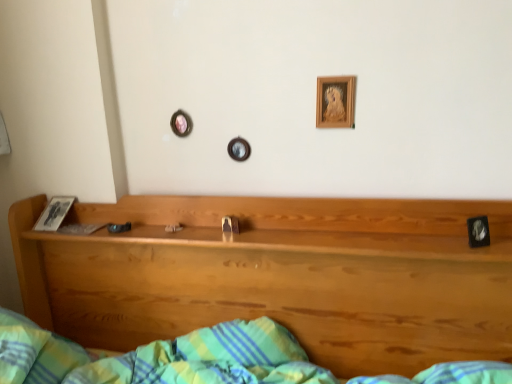
This screenshot has height=384, width=512. Describe the element at coordinates (478, 231) in the screenshot. I see `black glossy picture frame at right, acting as the 2th picture frame starting from the back` at that location.

What do you see at coordinates (335, 102) in the screenshot? The height and width of the screenshot is (384, 512). I see `wooden picture frame at upper center, the 1th picture frame when ordered from left to right` at bounding box center [335, 102].

You are a GUI agent. You are given a task and a screenshot of the screen. Output one action in this format:
    pyautogui.click(x=<x>, y=<y>)
    Task: Click on the black glossy picture frame at right, positioned as the first picture frame in front-to-back order
    The width and height of the screenshot is (512, 384).
    Given the screenshot: What is the action you would take?
    pyautogui.click(x=478, y=231)

Which of these two, wooden headboard at center or wooden picture frame at upper center, the 2th picture frame from the front, is thinner?

Thinner between the two is wooden picture frame at upper center, the 2th picture frame from the front.

From a real-world perspective, relative to wooden picture frame at upper center, which ranks as the 1th picture frame in top-to-bottom order, is wooden headboard at center vertically above or below?

Clearly, from a real-world perspective, wooden headboard at center is below wooden picture frame at upper center, which ranks as the 1th picture frame in top-to-bottom order.

Measure the distance between wooden headboard at center and wooden picture frame at upper center, the 1th picture frame positioned from the back.

wooden headboard at center and wooden picture frame at upper center, the 1th picture frame positioned from the back, are 23.59 inches apart.

Is wooden headboard at center with wooden picture frame at upper center, the 2th picture frame from the front?

No.

Can you tell me how much wooden picture frame at upper center, arranged as the second picture frame when viewed from the right, and black glossy picture frame at right, the first picture frame from the right, differ in facing direction?

wooden picture frame at upper center, arranged as the second picture frame when viewed from the right, and black glossy picture frame at right, the first picture frame from the right, are facing 28.7 degrees away from each other.

Considering the relative sizes of wooden picture frame at upper center, the 1th picture frame when ordered from left to right, and black glossy picture frame at right, marked as the first picture frame in a bottom-to-top arrangement, in the image provided, is wooden picture frame at upper center, the 1th picture frame when ordered from left to right, taller than black glossy picture frame at right, marked as the first picture frame in a bottom-to-top arrangement,?

Indeed, wooden picture frame at upper center, the 1th picture frame when ordered from left to right, has a greater height compared to black glossy picture frame at right, marked as the first picture frame in a bottom-to-top arrangement.

Is wooden picture frame at upper center, which appears as the second picture frame when ordered from the bottom, far away from black glossy picture frame at right, marked as the first picture frame in a bottom-to-top arrangement?

That's not correct — wooden picture frame at upper center, which appears as the second picture frame when ordered from the bottom, is a little close to black glossy picture frame at right, marked as the first picture frame in a bottom-to-top arrangement.

This screenshot has width=512, height=384. I want to click on picture frame above the black glossy picture frame at right, which is counted as the 2th picture frame, starting from the left (from a real-world perspective), so click(335, 102).

Considering the sizes of black glossy picture frame at right, which is counted as the 2th picture frame, starting from the left, and wooden picture frame at upper center, the 1th picture frame positioned from the back, in the image, is black glossy picture frame at right, which is counted as the 2th picture frame, starting from the left, bigger or smaller than wooden picture frame at upper center, the 1th picture frame positioned from the back,?

black glossy picture frame at right, which is counted as the 2th picture frame, starting from the left, is smaller than wooden picture frame at upper center, the 1th picture frame positioned from the back.

In terms of height, does black glossy picture frame at right, acting as the 2th picture frame starting from the back, look taller or shorter compared to wooden picture frame at upper center, arranged as the second picture frame when viewed from the right?

Clearly, black glossy picture frame at right, acting as the 2th picture frame starting from the back, is shorter compared to wooden picture frame at upper center, arranged as the second picture frame when viewed from the right.

Is black glossy picture frame at right, which is counted as the 2th picture frame, starting from the left, completely or partially outside of wooden picture frame at upper center, which ranks as the 1th picture frame in top-to-bottom order?

Absolutely, black glossy picture frame at right, which is counted as the 2th picture frame, starting from the left, is external to wooden picture frame at upper center, which ranks as the 1th picture frame in top-to-bottom order.

From the image's perspective, relative to wooden picture frame at upper center, the 2th picture frame from the front, is black glossy picture frame at right, the first picture frame from the right, above or below?

black glossy picture frame at right, the first picture frame from the right, is situated lower than wooden picture frame at upper center, the 2th picture frame from the front, in the image.

Is black glossy picture frame at right, the first picture frame from the right, taller or shorter than wooden headboard at center?

Considering their sizes, black glossy picture frame at right, the first picture frame from the right, has less height than wooden headboard at center.

Is point (468, 220) closer to camera compared to point (118, 282)?

That is True.

Is black glossy picture frame at right, which is counted as the 2th picture frame, starting from the left, in front of wooden headboard at center?

No, it is not.

Find the location of a particular element. bunk bed lying below the wooden picture frame at upper center, the 1th picture frame positioned from the back (from the image's perspective) is located at coordinates (279, 276).

Is wooden picture frame at upper center, the 2th picture frame from the front, with wooden headboard at center?

wooden picture frame at upper center, the 2th picture frame from the front, and wooden headboard at center are not in contact.

Based on the photo, is wooden picture frame at upper center, which appears as the second picture frame when ordered from the bottom, taller than wooden headboard at center?

In fact, wooden picture frame at upper center, which appears as the second picture frame when ordered from the bottom, may be shorter than wooden headboard at center.

Is the depth of wooden picture frame at upper center, which ranks as the 1th picture frame in top-to-bottom order, greater than that of wooden headboard at center?

Yes, it is behind wooden headboard at center.

How many degrees apart are the facing directions of wooden headboard at center and black glossy picture frame at right, positioned as the first picture frame in front-to-back order?

26.9 degrees separate the facing orientations of wooden headboard at center and black glossy picture frame at right, positioned as the first picture frame in front-to-back order.

Is point (110, 319) farther from camera compared to point (488, 235)?

Yes, it is behind point (488, 235).

Is wooden headboard at center closer to camera compared to black glossy picture frame at right, the first picture frame from the right?

Yes.

At what (x,y) coordinates should I click in order to perform the action: click on picture frame that is the 2nd object above the wooden headboard at center (from a real-world perspective). Please return your answer as a coordinate pair (x, y). The height and width of the screenshot is (384, 512). Looking at the image, I should click on (335, 102).

The height and width of the screenshot is (384, 512). I want to click on picture frame below the wooden picture frame at upper center, which appears as the second picture frame when ordered from the bottom (from a real-world perspective), so click(x=478, y=231).

From the image, which object appears to be nearer to black glossy picture frame at right, marked as the first picture frame in a bottom-to-top arrangement, wooden headboard at center or wooden picture frame at upper center, arranged as the second picture frame when viewed from the right?

wooden picture frame at upper center, arranged as the second picture frame when viewed from the right, is positioned closer to the anchor black glossy picture frame at right, marked as the first picture frame in a bottom-to-top arrangement.

Looking at the image, which one is located further to black glossy picture frame at right, marked as the first picture frame in a bottom-to-top arrangement, wooden picture frame at upper center, the 2th picture frame from the front, or wooden headboard at center?

The object further to black glossy picture frame at right, marked as the first picture frame in a bottom-to-top arrangement, is wooden headboard at center.

From the image, which object appears to be farther from wooden picture frame at upper center, the 1th picture frame when ordered from left to right, black glossy picture frame at right, which is counted as the 2th picture frame, starting from the left, or wooden headboard at center?

Based on the image, wooden headboard at center appears to be further to wooden picture frame at upper center, the 1th picture frame when ordered from left to right.

When comparing their distances from wooden headboard at center, does wooden picture frame at upper center, the 1th picture frame positioned from the back, or black glossy picture frame at right, which is the 2th picture frame from top to bottom, seem further?

black glossy picture frame at right, which is the 2th picture frame from top to bottom, is further to wooden headboard at center.

Looking at the image, which one is located further to wooden headboard at center, black glossy picture frame at right, marked as the first picture frame in a bottom-to-top arrangement, or wooden picture frame at upper center, which appears as the second picture frame when ordered from the bottom?

The object further to wooden headboard at center is black glossy picture frame at right, marked as the first picture frame in a bottom-to-top arrangement.

Estimate the real-world distances between objects in this image. Which object is closer to wooden picture frame at upper center, arranged as the second picture frame when viewed from the right, wooden headboard at center or black glossy picture frame at right, the first picture frame from the right?

black glossy picture frame at right, the first picture frame from the right, is closer to wooden picture frame at upper center, arranged as the second picture frame when viewed from the right.

At what (x,y) coordinates should I click in order to perform the action: click on picture frame between wooden headboard at center and wooden picture frame at upper center, the 1th picture frame positioned from the back, from front to back. Please return your answer as a coordinate pair (x, y). This screenshot has width=512, height=384. Looking at the image, I should click on (478, 231).